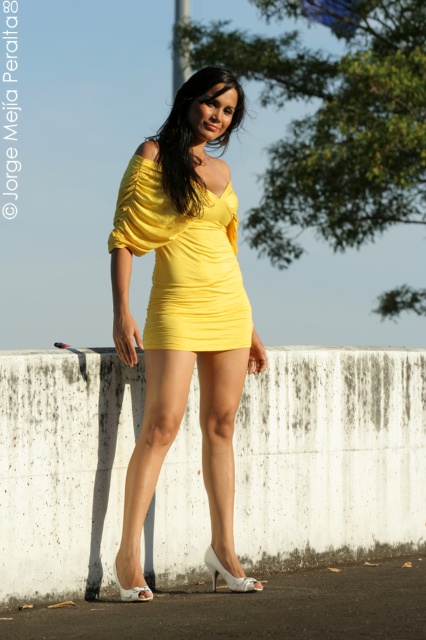
Is matte yellow dress at center in front of yellow matte dress at center?

Yes, matte yellow dress at center is closer to the viewer.

Who is more distant from viewer, (123, 276) or (189, 285)?

The point (123, 276) is more distant.

This screenshot has height=640, width=426. What do you see at coordinates (183, 307) in the screenshot? I see `matte yellow dress at center` at bounding box center [183, 307].

Locate an element on the screen. This screenshot has height=640, width=426. matte yellow dress at center is located at coordinates (183, 307).